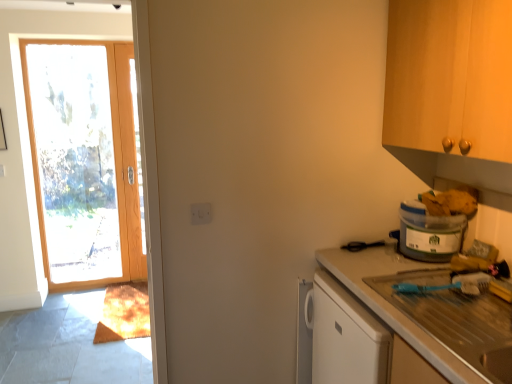
Question: From the image's perspective, is smooth white countertop at right under translucent plastic container at right?

Choices:
 (A) yes
 (B) no

Answer: (A)

Question: From a real-world perspective, is smooth white countertop at right below translucent plastic container at right?

Choices:
 (A) no
 (B) yes

Answer: (B)

Question: Is smooth white countertop at right shorter than translucent plastic container at right?

Choices:
 (A) no
 (B) yes

Answer: (A)

Question: Is smooth white countertop at right closer to camera compared to translucent plastic container at right?

Choices:
 (A) no
 (B) yes

Answer: (B)

Question: Can you confirm if smooth white countertop at right is bigger than translucent plastic container at right?

Choices:
 (A) yes
 (B) no

Answer: (A)

Question: Is smooth white countertop at right in contact with translucent plastic container at right?

Choices:
 (A) no
 (B) yes

Answer: (A)

Question: Can you confirm if translucent plastic container at right is positioned to the right of wooden door at left?

Choices:
 (A) yes
 (B) no

Answer: (A)

Question: Are translucent plastic container at right and wooden door at left beside each other?

Choices:
 (A) no
 (B) yes

Answer: (A)

Question: Can we say translucent plastic container at right lies outside wooden door at left?

Choices:
 (A) no
 (B) yes

Answer: (B)

Question: Is translucent plastic container at right thinner than wooden door at left?

Choices:
 (A) no
 (B) yes

Answer: (A)

Question: Does translucent plastic container at right come in front of wooden door at left?

Choices:
 (A) yes
 (B) no

Answer: (A)

Question: From the image's perspective, is translucent plastic container at right below wooden door at left?

Choices:
 (A) yes
 (B) no

Answer: (A)

Question: Considering the relative positions of white plastic electric outlet at center and translucent plastic container at right in the image provided, is white plastic electric outlet at center to the right of translucent plastic container at right from the viewer's perspective?

Choices:
 (A) yes
 (B) no

Answer: (B)